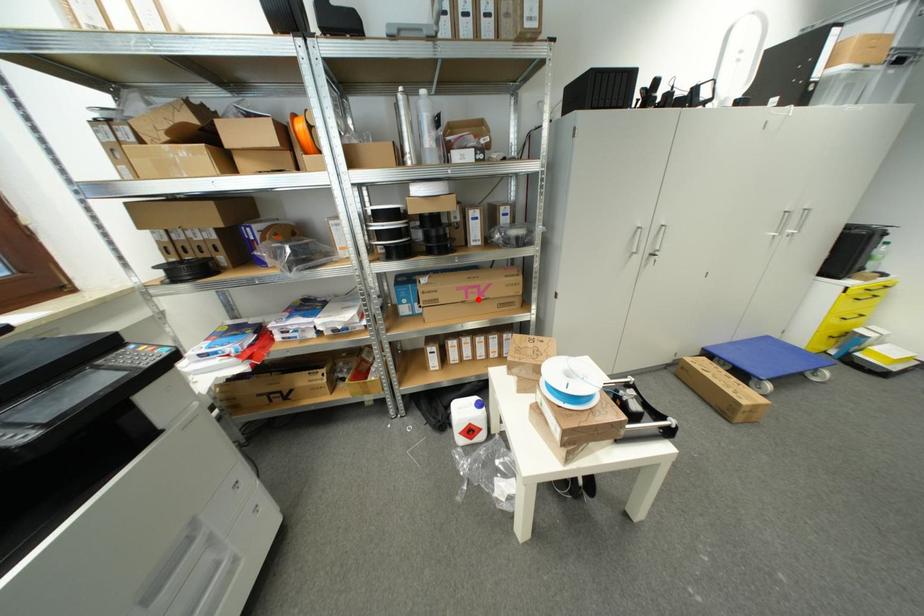
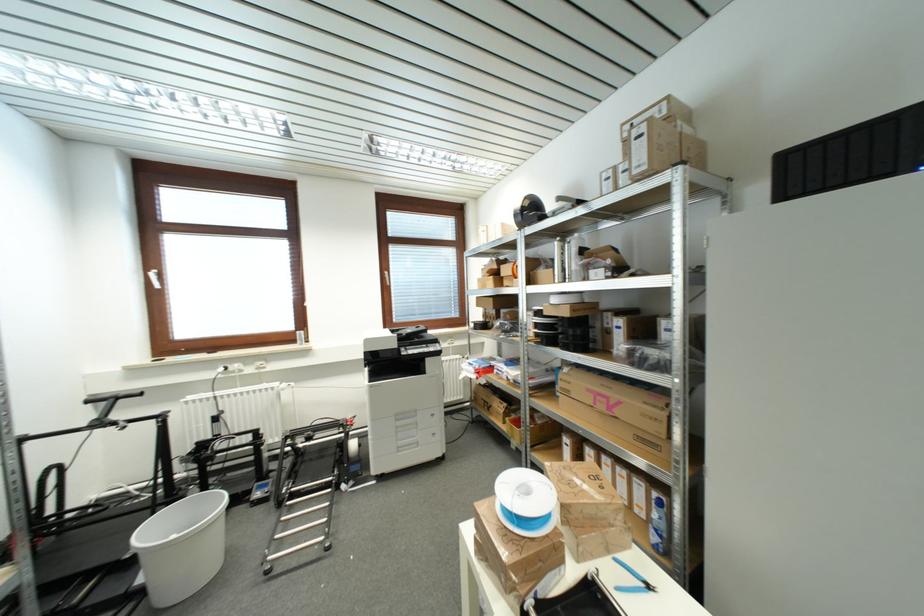
Where in the second image is the point corresponding to the highlighted location from the first image?

(605, 408)